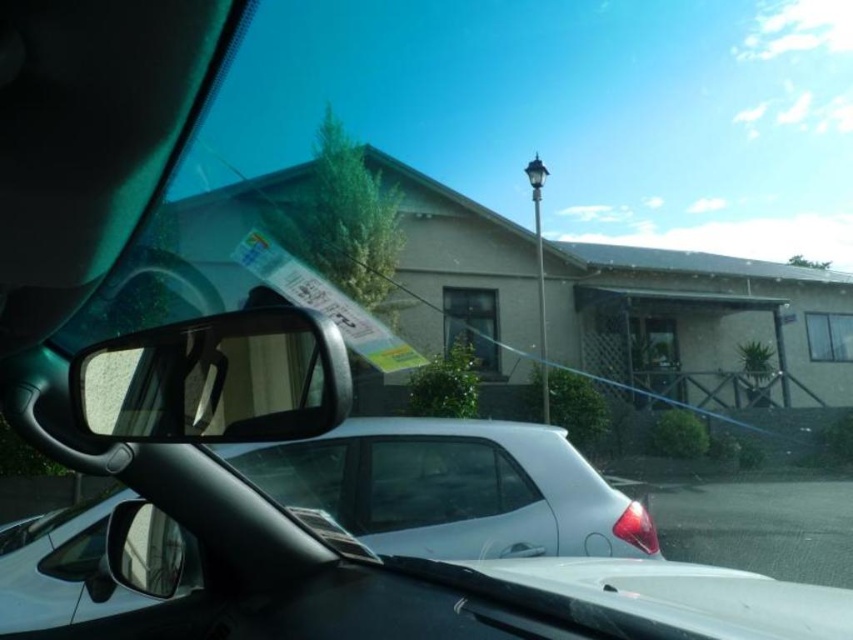
Question: Which is nearer to the transparent plastic view mirror at left?

Choices:
 (A) white glossy car at center
 (B) transparent glass car window at center

Answer: (B)

Question: Which object is closer to the camera taking this photo?

Choices:
 (A) transparent plastic view mirror at left
 (B) transparent glass car window at center
 (C) white glossy car at center

Answer: (A)

Question: Which point is farther to the camera?

Choices:
 (A) transparent glass car window at center
 (B) white glossy car at center

Answer: (A)

Question: Can you confirm if transparent plastic view mirror at left is positioned above transparent glass car window at center?

Choices:
 (A) yes
 (B) no

Answer: (A)

Question: Does white glossy car at center have a larger size compared to transparent plastic view mirror at left?

Choices:
 (A) yes
 (B) no

Answer: (A)

Question: Is white glossy car at center further to the viewer compared to transparent plastic view mirror at left?

Choices:
 (A) no
 (B) yes

Answer: (B)